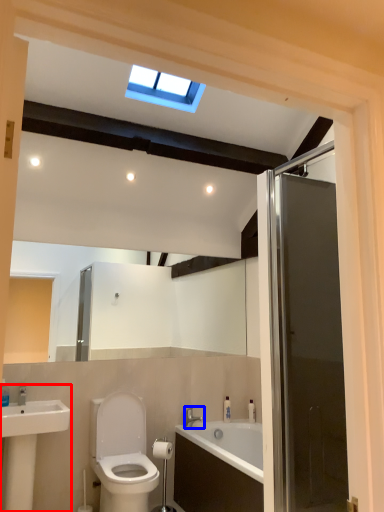
Question: Which of the following is the closest to the observer, sink (highlighted by a red box) or tap (highlighted by a blue box)?

Choices:
 (A) sink
 (B) tap

Answer: (A)